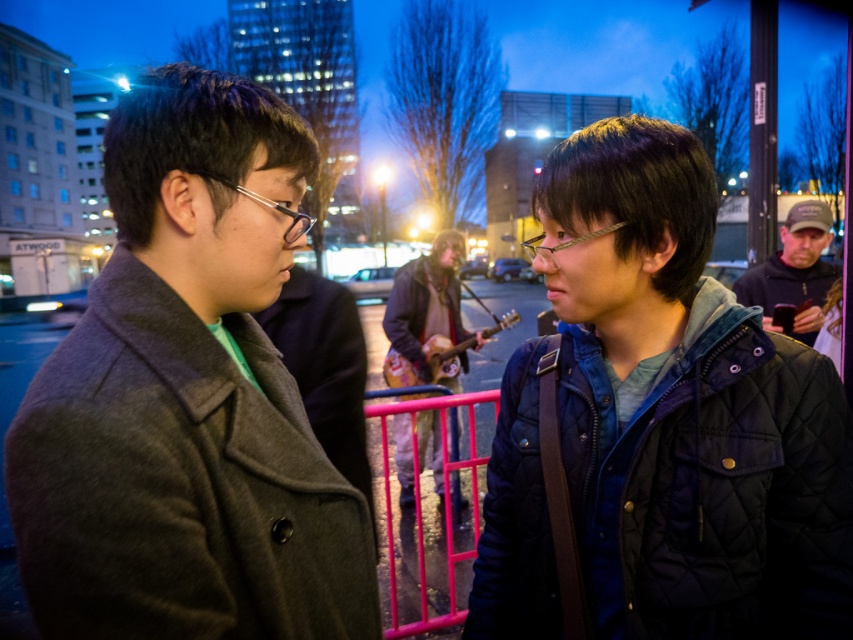
Measure the distance between point (305, 554) and camera.

Point (305, 554) and camera are 36.60 inches apart.

Is gray wool coat at left closer to the viewer compared to camouflage-patterned jacket at center?

Yes, gray wool coat at left is closer to the viewer.

Where is `gray wool coat at left`? The image size is (853, 640). gray wool coat at left is located at coordinates (189, 397).

The height and width of the screenshot is (640, 853). I want to click on gray wool coat at left, so click(x=189, y=397).

From the picture: Who is more forward, (363, 516) or (589, 376)?

Positioned in front is point (363, 516).

In the scene shown: Can you confirm if gray wool coat at left is shorter than quilted dark blue jacket at center?

Yes, gray wool coat at left is shorter than quilted dark blue jacket at center.

Where is `gray wool coat at left`? Image resolution: width=853 pixels, height=640 pixels. gray wool coat at left is located at coordinates (189, 397).

Describe the element at coordinates (660, 422) in the screenshot. I see `quilted dark blue jacket at center` at that location.

Locate an element on the screen. The image size is (853, 640). quilted dark blue jacket at center is located at coordinates (660, 422).